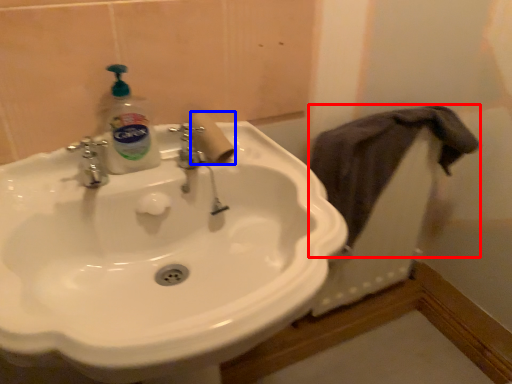
Question: Which object is further to the camera taking this photo, bath towel (highlighted by a red box) or toilet paper (highlighted by a blue box)?

Choices:
 (A) bath towel
 (B) toilet paper

Answer: (A)